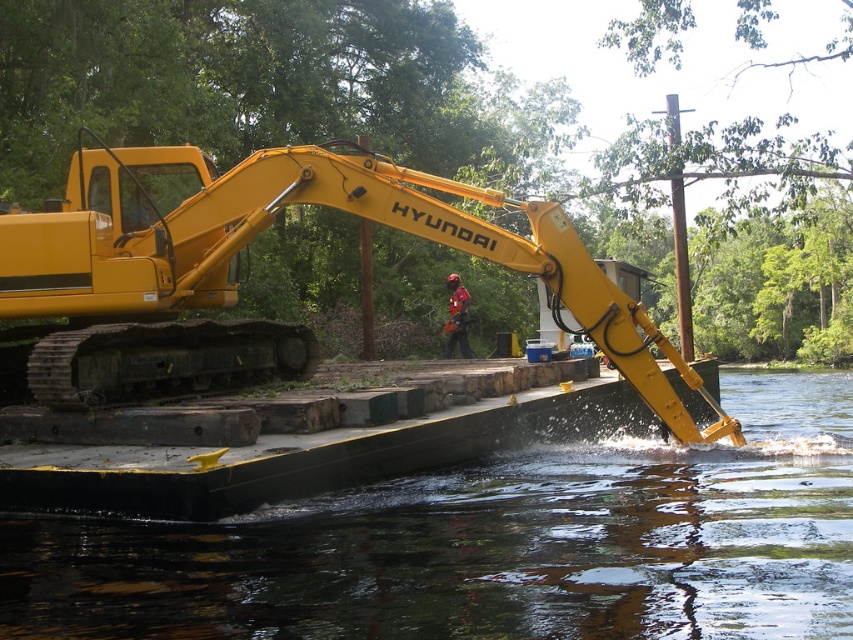
Can you confirm if black rubber boat at lower center is positioned to the right of yellow rubber track at center?

Yes, black rubber boat at lower center is to the right of yellow rubber track at center.

Which is more to the right, black rubber boat at lower center or yellow rubber track at center?

From the viewer's perspective, black rubber boat at lower center appears more on the right side.

Does point (234, 611) lie behind point (299, 163)?

No, (234, 611) is in front of (299, 163).

At what (x,y) coordinates should I click in order to perform the action: click on black rubber boat at lower center. Please return your answer as a coordinate pair (x, y). Looking at the image, I should click on pyautogui.click(x=490, y=545).